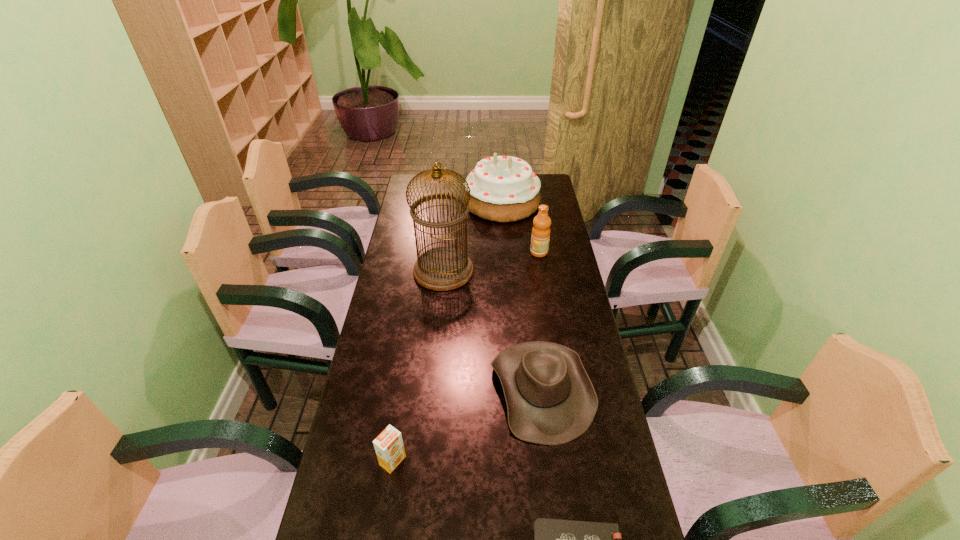
Find the location of `birdcage`. birdcage is located at coordinates (442, 268).

The width and height of the screenshot is (960, 540). In order to click on cake in this screenshot , I will do `click(503, 189)`.

Where is `fruit juice`? The image size is (960, 540). fruit juice is located at coordinates (540, 237).

Locate an element on the screen. This screenshot has width=960, height=540. the second nearest object is located at coordinates (389, 448).

Where is `cowboy hat`? cowboy hat is located at coordinates (550, 398).

Locate an element on the screen. This screenshot has width=960, height=540. free point located on the front-facing side of the tallest object is located at coordinates (487, 271).

The width and height of the screenshot is (960, 540). What are the coordinates of `vacant space located on the left of the farthest object` in the screenshot? It's located at (425, 202).

Identify the location of vacant space located 0.360m on the label side of the fruit juice. (441, 252).

Find the location of a particular element. blank space located 0.300m on the label side of the fruit juice is located at coordinates (456, 252).

The width and height of the screenshot is (960, 540). I want to click on free region located 0.110m on the label side of the fruit juice, so click(503, 252).